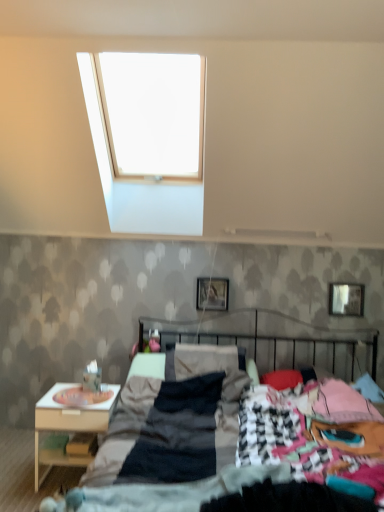
Question: Is metallic silver picture frame at upper right, the 1th picture frame viewed from the right, in front of or behind white wood nightstand at lower left in the image?

Choices:
 (A) behind
 (B) front

Answer: (A)

Question: Is point (362, 298) closer or farther from the camera than point (105, 402)?

Choices:
 (A) closer
 (B) farther

Answer: (B)

Question: Which object is positioned farthest from the metallic silver picture frame at upper right, the 1th picture frame viewed from the right?

Choices:
 (A) metallic silver picture frame at center, which ranks as the 2th picture frame in right-to-left order
 (B) dark gray fabric bed at center
 (C) white wood nightstand at lower left

Answer: (C)

Question: Based on their relative distances, which object is farther from the metallic silver picture frame at upper right, which is the second picture frame in left-to-right order?

Choices:
 (A) metallic silver picture frame at center, which ranks as the 2th picture frame in right-to-left order
 (B) dark gray fabric bed at center
 (C) white wood nightstand at lower left

Answer: (C)